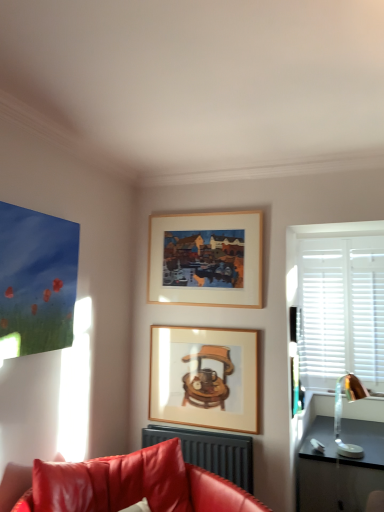
Question: Looking at the image, does matte black radiator at lower center seem bigger or smaller compared to wooden picture frame at center, marked as the first picture frame in a bottom-to-top arrangement?

Choices:
 (A) small
 (B) big

Answer: (B)

Question: From the image's perspective, is matte black radiator at lower center located above or below wooden picture frame at center, the second picture frame in the top-to-bottom sequence?

Choices:
 (A) below
 (B) above

Answer: (A)

Question: Estimate the real-world distances between objects in this image. Which object is closer to the leather couch at lower left?

Choices:
 (A) wooden frame at upper center, marked as the second picture frame in a bottom-to-top arrangement
 (B) matte black radiator at lower center
 (C) metallic gold lamp at right
 (D) wooden picture frame at center, the second picture frame in the top-to-bottom sequence

Answer: (B)

Question: Estimate the real-world distances between objects in this image. Which object is farther from the metallic gold lamp at right?

Choices:
 (A) matte black radiator at lower center
 (B) wooden frame at upper center, marked as the second picture frame in a bottom-to-top arrangement
 (C) leather couch at lower left
 (D) wooden picture frame at center, the second picture frame in the top-to-bottom sequence

Answer: (C)